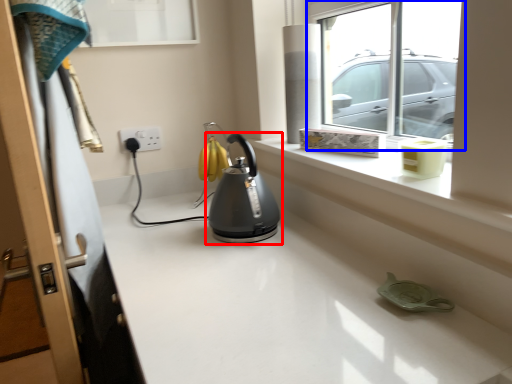
Question: Which point is further to the camera, kettle (highlighted by a red box) or window (highlighted by a blue box)?

Choices:
 (A) kettle
 (B) window

Answer: (A)